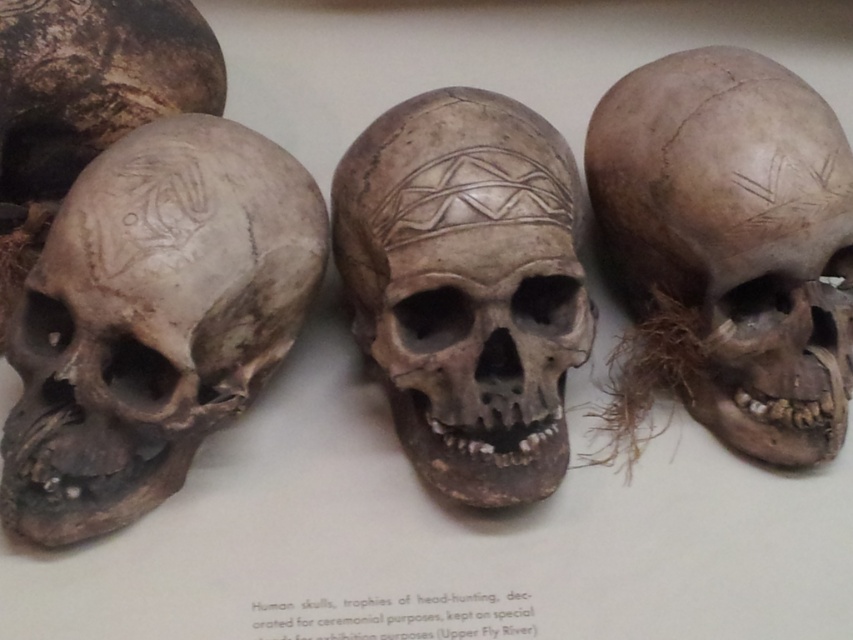
Between gray matte skull at left and matte gray skull at left, which one is positioned higher?

Positioned higher is matte gray skull at left.

Does gray matte skull at left come behind matte gray skull at left?

No.

Who is more distant from viewer, (157, 332) or (138, 61)?

Positioned behind is point (138, 61).

The width and height of the screenshot is (853, 640). I want to click on gray matte skull at left, so click(152, 320).

Is point (105, 413) positioned behind point (550, 259)?

No, it is in front of (550, 259).

This screenshot has width=853, height=640. In order to click on gray matte skull at left in this screenshot , I will do `click(152, 320)`.

Does brown textured skull at right have a smaller size compared to matte gray skull at left?

Incorrect, brown textured skull at right is not smaller in size than matte gray skull at left.

Is point (842, 145) farther from viewer compared to point (155, 44)?

No, (842, 145) is closer to viewer.

Is point (720, 64) farther from viewer compared to point (71, 163)?

No, (720, 64) is closer to viewer.

Locate an element on the screen. This screenshot has width=853, height=640. brown textured skull at right is located at coordinates (735, 237).